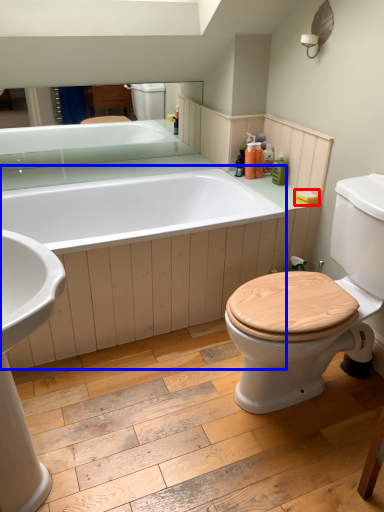
Question: Which object is further to the camera taking this photo, toilet paper (highlighted by a red box) or bath (highlighted by a blue box)?

Choices:
 (A) toilet paper
 (B) bath

Answer: (A)